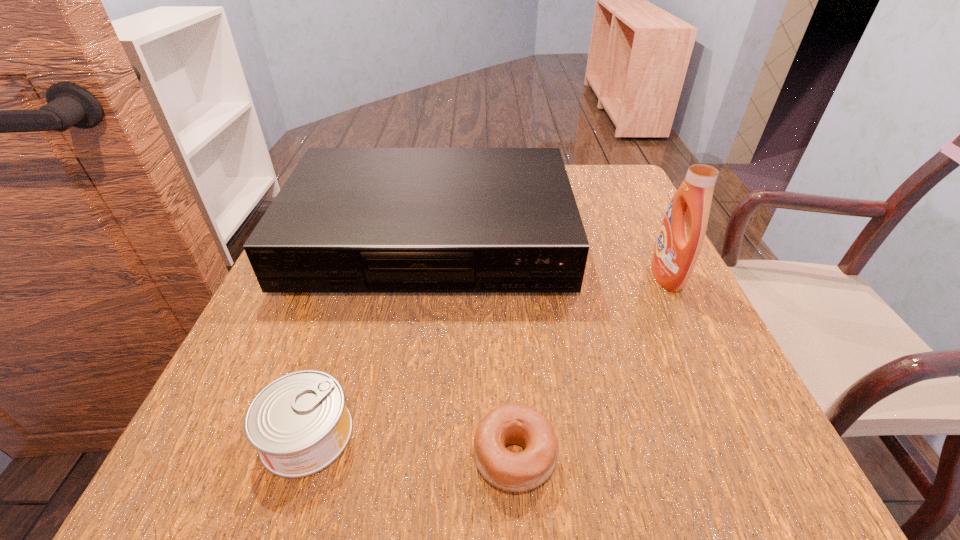
What are the coordinates of `object that is the third closest to the bagel` in the screenshot? It's located at (681, 236).

Identify which object is the closest to the shortest object. Please provide its 2D coordinates. Your answer should be formatted as a tuple, i.e. [(x, y)], where the tuple contains the x and y coordinates of a point satisfying the conditions above.

[(299, 423)]

At what (x,y) coordinates should I click in order to perform the action: click on vacant region that satisfies the following two spatial constraints: 1. on the front-facing side of the rightmost object; 2. on the front side of the shortest object. Please return your answer as a coordinate pair (x, y). Looking at the image, I should click on (754, 456).